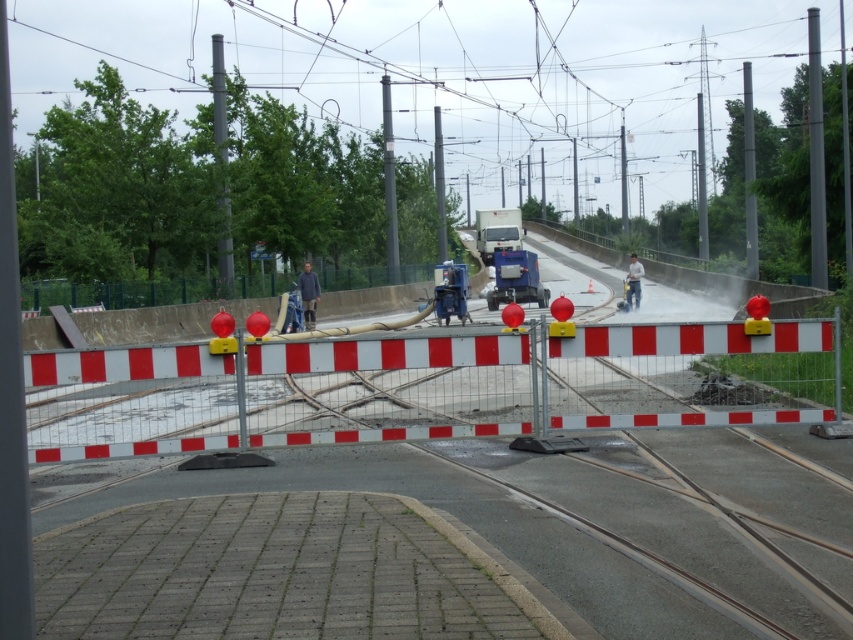
You are a delivery driver who needs to navigate through the construction site. You see a metallic silver barricade at center and a blue metallic machine at center. Which object should you avoid driving over to ensure safety?

The metallic silver barricade at center is larger in size than the blue metallic machine at center, so you should avoid driving over the metallic silver barricade at center as it is more prominent and likely part of the safety barriers.

You are a delivery driver who needs to navigate through the construction site shown in the image. You must avoid the metallic silver barricade at center. What is the safest path to take around it?

The metallic silver barricade at center is located at point (538, 381). To safely navigate around it, you should drive either to the left or right of the barricade, staying clear of its position to avoid collision.

You are a delivery driver who needs to navigate through the construction site. You see the metallic silver barricade at center and the blue metallic machine at center. Which object is lower in height and might allow you to pass under it without hitting your truck?

The metallic silver barricade at center is shorter than the blue metallic machine at center, so it is lower in height and might allow you to pass under it without hitting your truck.